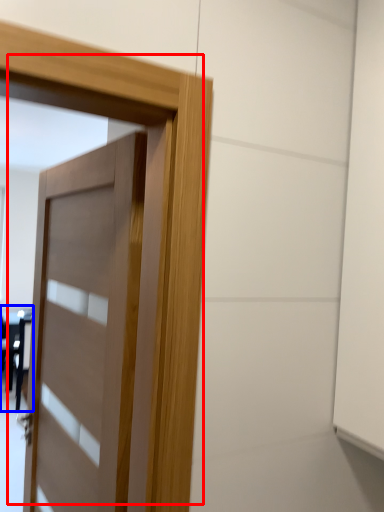
Question: Among these objects, which one is nearest to the camera, door (highlighted by a red box) or table (highlighted by a blue box)?

Choices:
 (A) door
 (B) table

Answer: (A)